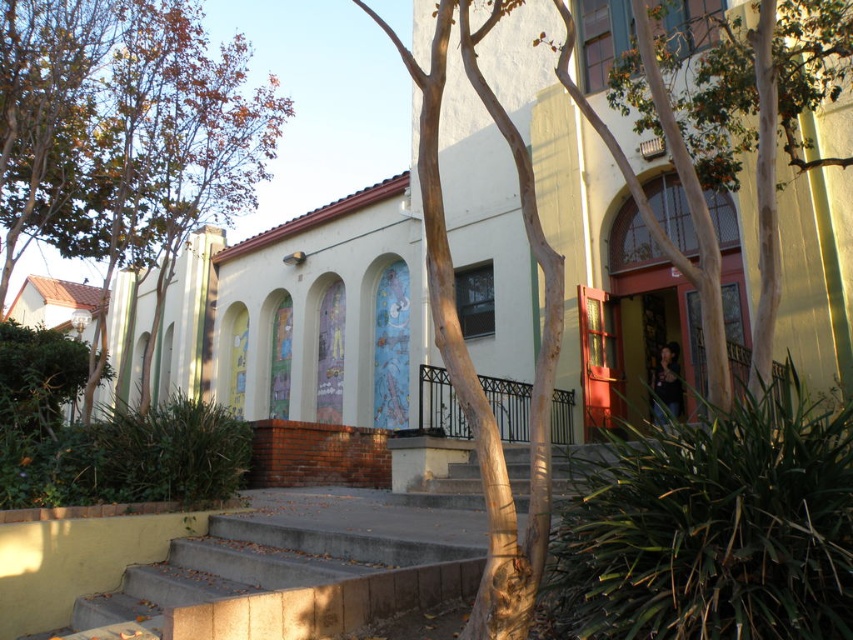
Can you confirm if brown leafy tree at upper left is positioned to the right of concrete/steps at lower center?

No, brown leafy tree at upper left is not to the right of concrete/steps at lower center.

Between point (1, 225) and point (158, 593), which one is positioned behind?

Positioned behind is point (1, 225).

Where is `brown leafy tree at upper left`? brown leafy tree at upper left is located at coordinates (126, 138).